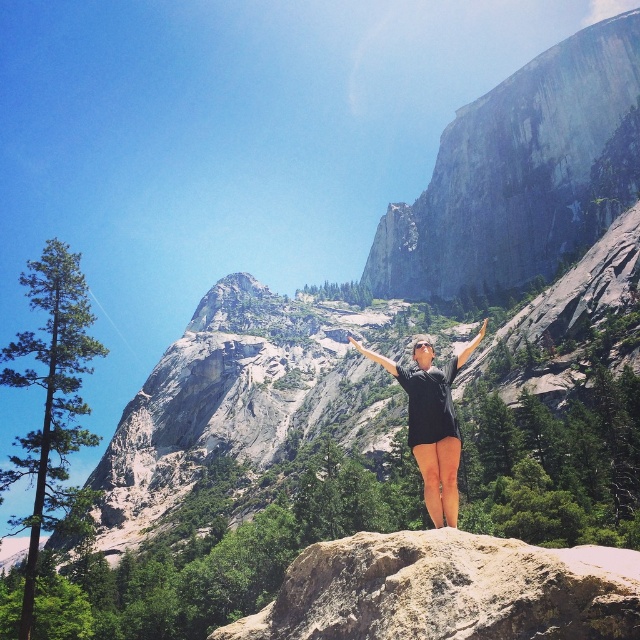
Question: Estimate the real-world distances between objects in this image. Which object is farther from the smooth granite cliff at upper right?

Choices:
 (A) black fabric arm at center
 (B) smooth skin hand at center

Answer: (A)

Question: Which object is positioned farthest from the black matte arm at center?

Choices:
 (A) smooth skin hand at center
 (B) smooth granite cliff at upper right
 (C) matte black hand at upper center
 (D) black fabric arm at center

Answer: (B)

Question: Considering the relative positions of black matte shirt at center and black matte arm at center in the image provided, where is black matte shirt at center located with respect to black matte arm at center?

Choices:
 (A) above
 (B) below

Answer: (B)

Question: Does smooth beige rock at center lie behind matte black hand at upper center?

Choices:
 (A) yes
 (B) no

Answer: (B)

Question: Is smooth beige rock at center above black fabric arm at center?

Choices:
 (A) yes
 (B) no

Answer: (B)

Question: Which point is closer to the camera taking this photo?

Choices:
 (A) (378, 362)
 (B) (356, 342)

Answer: (A)